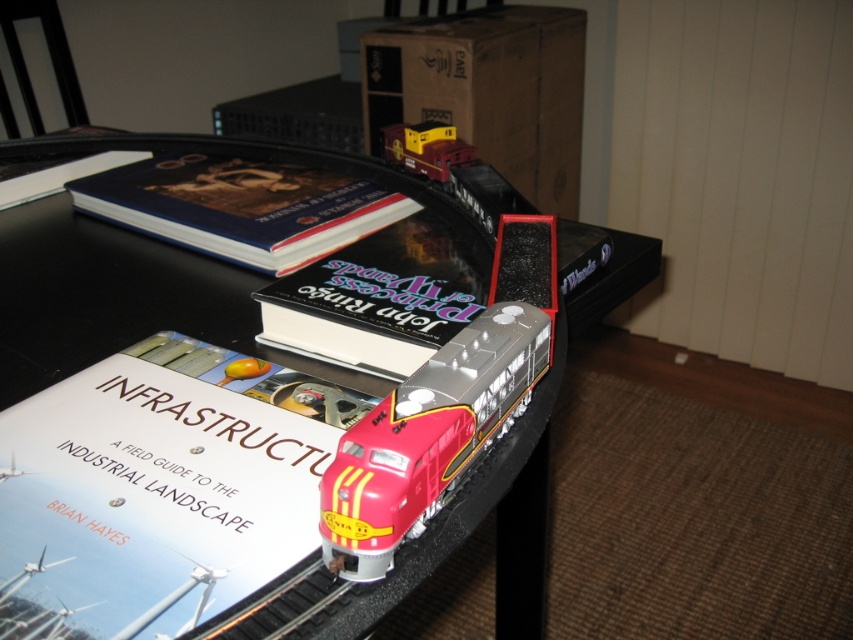
You are holding a 12 inch ruler and want to measure the distance from the camera to the point at coordinates point (351, 160). How many rulers would you need to stack end to end to reach that point?

The point at coordinates point (351, 160) is 38.90 inches from the camera, so you would need approximately 3 rulers stacked end to end to reach that point since 38.90 divided by 12 is approximately 3.24.

You are organizing a model train display and need to ensure the hardcover book at center and the matte red train at center fit side by side on a shelf that is 1.2 meters wide. Given their widths, can both items fit together without overlapping?

The hardcover book at center is wider than the matte red train at center. However, since the total width of both items combined is not provided, it is impossible to determine if they can fit on the 1.2 meters shelf without overlapping.